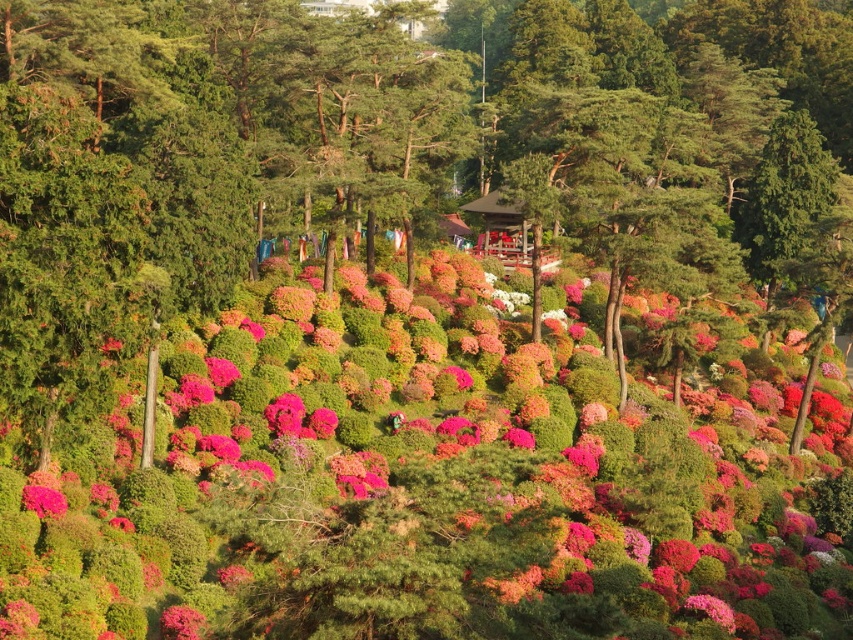
Is pink matte bush at center above vivid pink petals at lower left?

Indeed, pink matte bush at center is positioned over vivid pink petals at lower left.

Which is more to the right, pink matte bush at center or vivid pink petals at lower left?

pink matte bush at center

Measure the distance between pink matte bush at center and camera.

pink matte bush at center and camera are 75.87 feet apart.

I want to click on pink matte bush at center, so click(437, 484).

Is point (186, 609) positioned behind point (53, 508)?

No, (186, 609) is closer to viewer.

Is pink matte flower at lower left below vivid pink petals at lower left?

Yes.

Is point (196, 627) behind point (41, 492)?

No, (196, 627) is closer to viewer.

Locate an element on the screen. Image resolution: width=853 pixels, height=640 pixels. pink matte flower at lower left is located at coordinates (181, 621).

Does pink matte bush at center appear under pink matte flower at lower left?

No.

This screenshot has height=640, width=853. In order to click on pink matte bush at center in this screenshot , I will do `click(437, 484)`.